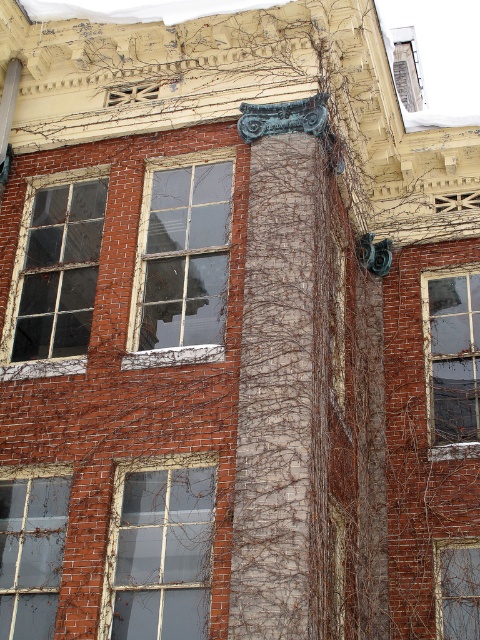
Which is below, transparent glass window at center or transparent glass window at lower right?

Positioned lower is transparent glass window at lower right.

Does point (194, 189) come farther from viewer compared to point (448, 628)?

That is False.

Locate an element on the screen. transparent glass window at center is located at coordinates (181, 260).

In the scene shown: Does transparent glass window at center appear on the right side of clear glass window at center?

Yes, transparent glass window at center is to the right of clear glass window at center.

Does transparent glass window at center appear over clear glass window at center?

Indeed, transparent glass window at center is positioned over clear glass window at center.

Who is more distant from viewer, (159, 186) or (182, 528)?

Point (159, 186)

This screenshot has width=480, height=640. What are the coordinates of `transparent glass window at center` in the screenshot? It's located at (181, 260).

Which of these two, clear glass window at center or transparent glass window at right, stands shorter?

Standing shorter between the two is clear glass window at center.

Does clear glass window at center appear over transparent glass window at right?

No, clear glass window at center is not above transparent glass window at right.

Who is more distant from viewer, (171, 582) or (444, 438)?

Positioned behind is point (444, 438).

Identify the location of clear glass window at center. (159, 548).